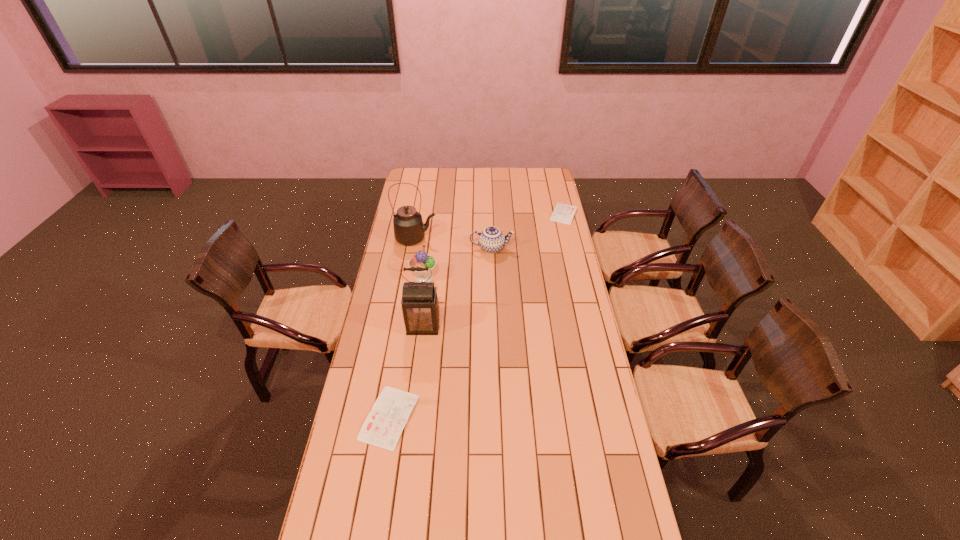
Identify which object is the second nearest to the taller diary. Please provide its 2D coordinates. Your answer should be formatted as a tuple, i.e. [(x, y)], where the tuple contains the x and y coordinates of a point satisfying the conditions above.

[(421, 259)]

Locate an element on the screen. This screenshot has height=540, width=960. object identified as the second closest to the kettle is located at coordinates (491, 239).

This screenshot has height=540, width=960. Identify the location of free location that satisfies the following two spatial constraints: 1. spout on the kettle; 2. on the back side of the fourth farthest object. (410, 278).

Locate an element on the screen. The height and width of the screenshot is (540, 960). free space that satisfies the following two spatial constraints: 1. spout on the kettle; 2. on the left side of the third tallest object is located at coordinates (410, 278).

The image size is (960, 540). In order to click on vacant space that satisfies the following two spatial constraints: 1. at the spout of the chinaware; 2. on the front side of the third tallest object in this screenshot , I will do `click(492, 278)`.